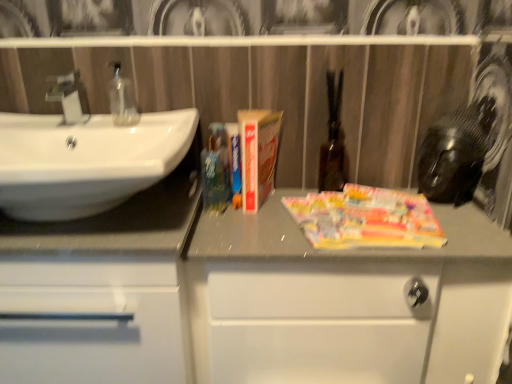
Locate an element on the screen. free space above white matte cabinet at center, the first bathroom cabinet positioned from the right (from a real-world perspective) is located at coordinates click(x=344, y=244).